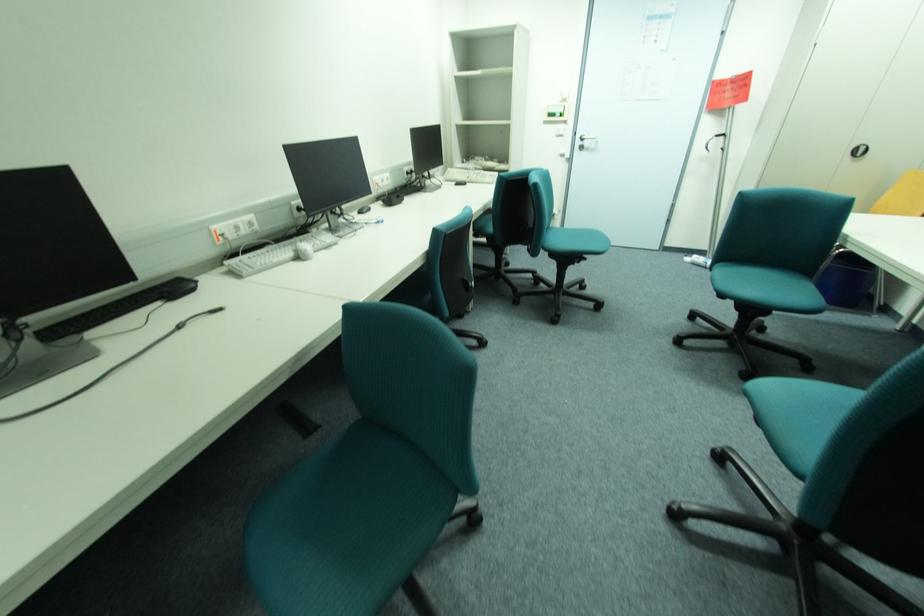
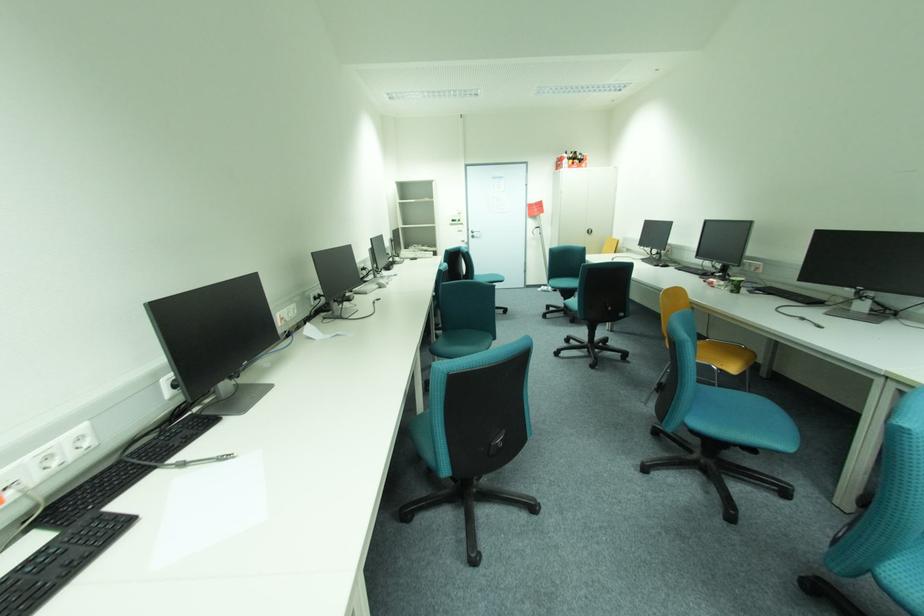
The point at (585,144) is marked in the first image. Where is the corresponding point in the second image?

(477, 235)